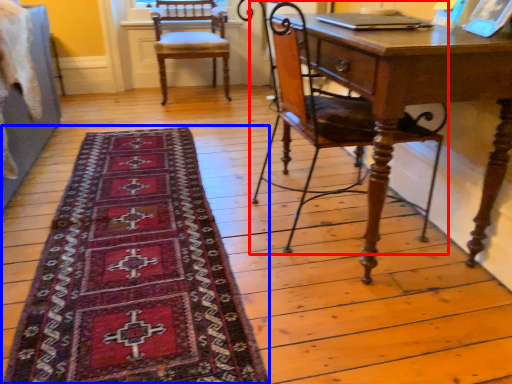
Question: Which object is further to the camera taking this photo, chair (highlighted by a red box) or mat (highlighted by a blue box)?

Choices:
 (A) chair
 (B) mat

Answer: (A)